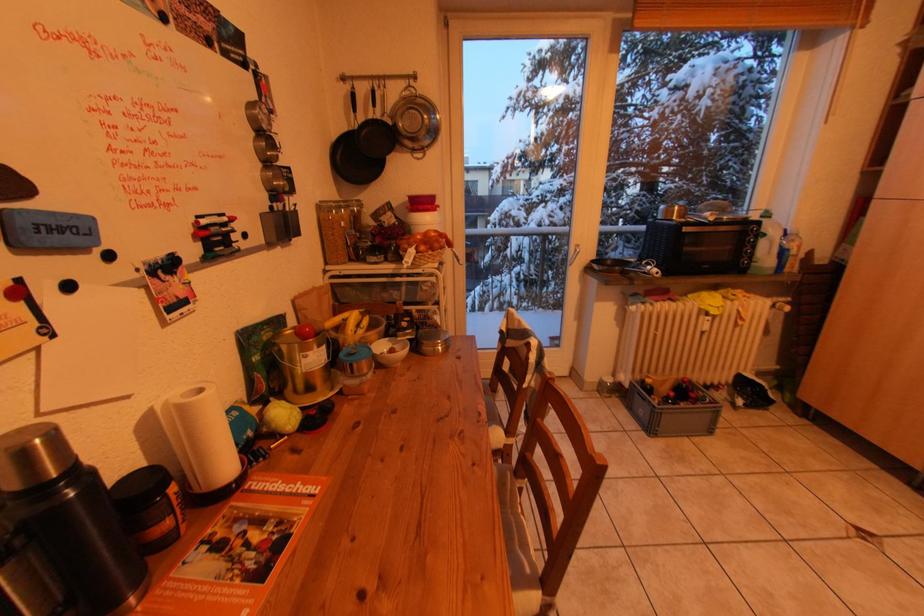
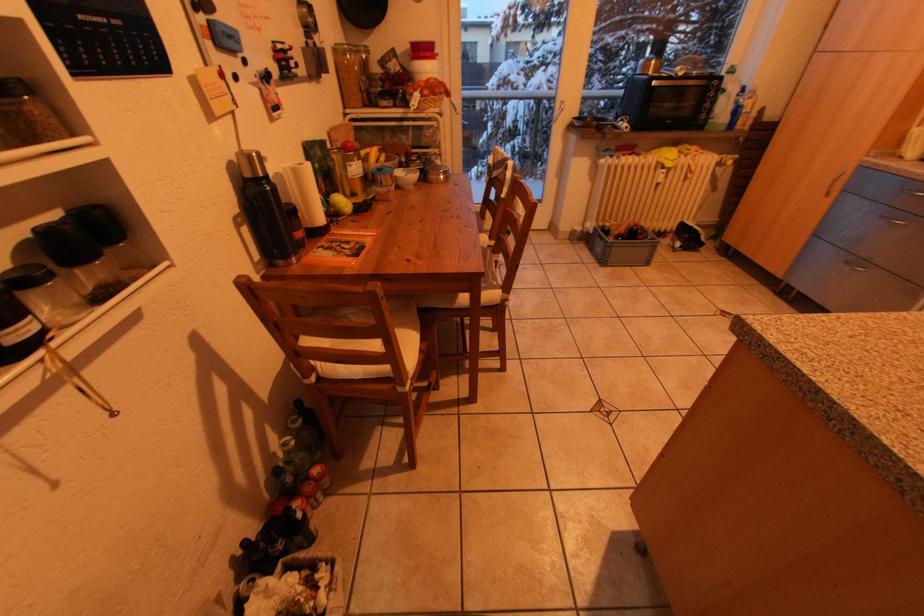
Question: The first image is from the beginning of the video and the second image is from the end. How did the camera likely rotate when shooting the video?

Choices:
 (A) Left
 (B) Right
 (C) Up
 (D) Down

Answer: (D)